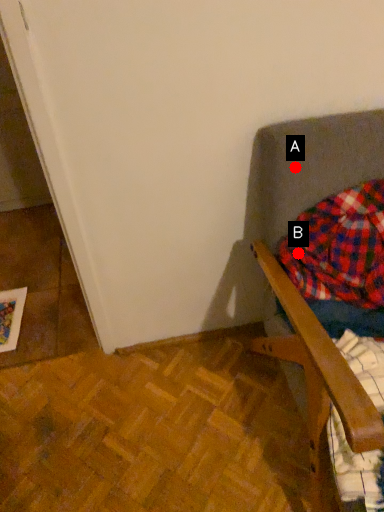
Question: Two points are circled on the image, labeled by A and B beside each circle. Which point is closer to the camera?

Choices:
 (A) A is closer
 (B) B is closer

Answer: (A)